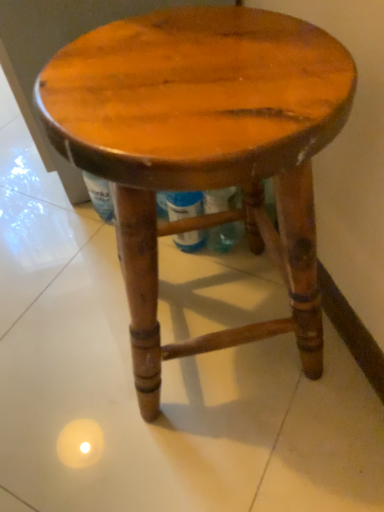
Locate an element on the screen. This screenshot has height=512, width=384. vacant space in front of wooden stool at center is located at coordinates (222, 451).